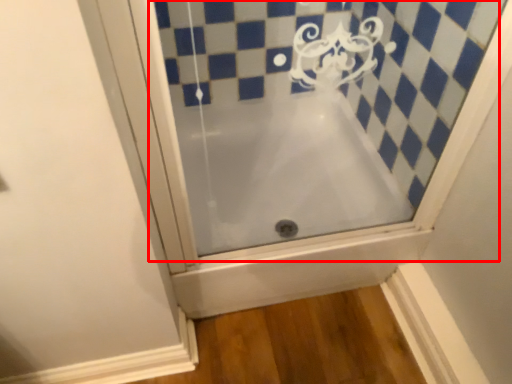
Question: In this image, where is bath (annotated by the red box) located relative to bathtub?

Choices:
 (A) right
 (B) left

Answer: (A)